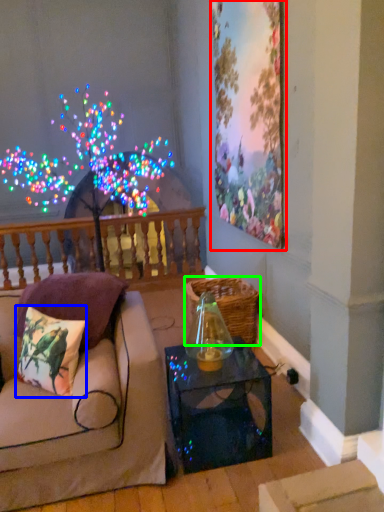
Question: Considering the real-world distances, which object is closest to picture frame (highlighted by a red box)? pillow (highlighted by a blue box) or basket (highlighted by a green box).

Choices:
 (A) pillow
 (B) basket

Answer: (B)